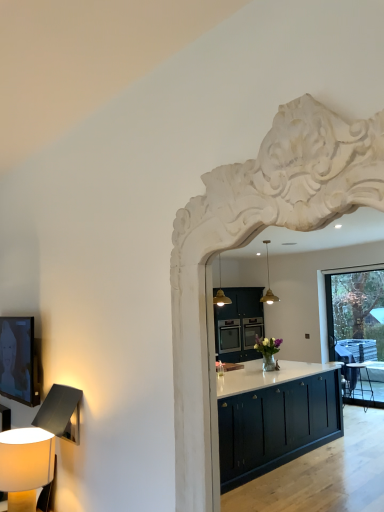
Question: From a real-world perspective, is matte beige lampshade at lower left located beneath white carved wood archway at upper center?

Choices:
 (A) yes
 (B) no

Answer: (A)

Question: From the image's perspective, is matte beige lampshade at lower left beneath white carved wood archway at upper center?

Choices:
 (A) yes
 (B) no

Answer: (A)

Question: Is matte beige lampshade at lower left located outside white carved wood archway at upper center?

Choices:
 (A) no
 (B) yes

Answer: (B)

Question: Considering the relative sizes of matte beige lampshade at lower left and white carved wood archway at upper center in the image provided, is matte beige lampshade at lower left thinner than white carved wood archway at upper center?

Choices:
 (A) yes
 (B) no

Answer: (B)

Question: From a real-world perspective, is matte beige lampshade at lower left over white carved wood archway at upper center?

Choices:
 (A) yes
 (B) no

Answer: (B)

Question: Is matte beige lampshade at lower left facing towards white carved wood archway at upper center?

Choices:
 (A) yes
 (B) no

Answer: (B)

Question: Is white carved wood archway at upper center looking in the opposite direction of matte beige lampshade at lower left?

Choices:
 (A) yes
 (B) no

Answer: (B)

Question: Would you say white carved wood archway at upper center is outside matte beige lampshade at lower left?

Choices:
 (A) yes
 (B) no

Answer: (A)

Question: Is white carved wood archway at upper center surrounding matte beige lampshade at lower left?

Choices:
 (A) no
 (B) yes

Answer: (A)

Question: Can you confirm if white carved wood archway at upper center is positioned to the right of matte beige lampshade at lower left?

Choices:
 (A) no
 (B) yes

Answer: (B)

Question: Does white carved wood archway at upper center have a lesser width compared to matte beige lampshade at lower left?

Choices:
 (A) no
 (B) yes

Answer: (B)

Question: From the image's perspective, is white carved wood archway at upper center below matte beige lampshade at lower left?

Choices:
 (A) no
 (B) yes

Answer: (A)

Question: Is point (14, 460) positioned closer to the camera than point (183, 393)?

Choices:
 (A) closer
 (B) farther

Answer: (B)